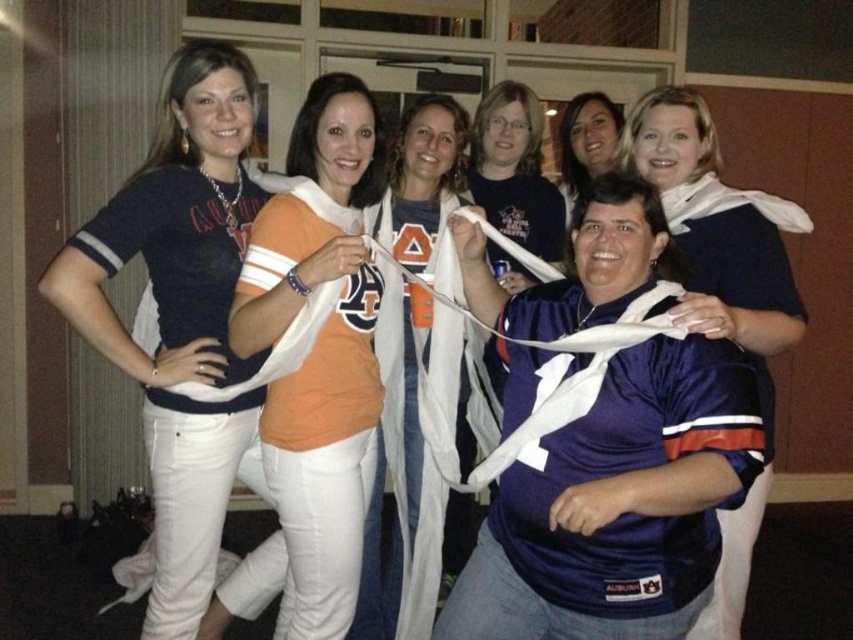
Question: Can you confirm if orange jersey at center is positioned to the right of matte white scarf at center?

Choices:
 (A) no
 (B) yes

Answer: (A)

Question: Is white fabric scarf at center behind matte white scarf at center?

Choices:
 (A) no
 (B) yes

Answer: (A)

Question: Considering the real-world distances, which object is farthest from the white fabric scarf at center?

Choices:
 (A) orange jersey at center
 (B) satin blue jersey at center

Answer: (B)

Question: Does white satin scarf at center have a greater width compared to white fabric ribbon at center?

Choices:
 (A) no
 (B) yes

Answer: (A)

Question: Which point is farther from the camera taking this photo?

Choices:
 (A) (509, 584)
 (B) (560, 189)

Answer: (B)

Question: Which point is closer to the camera?

Choices:
 (A) (317, 88)
 (B) (563, 150)

Answer: (A)